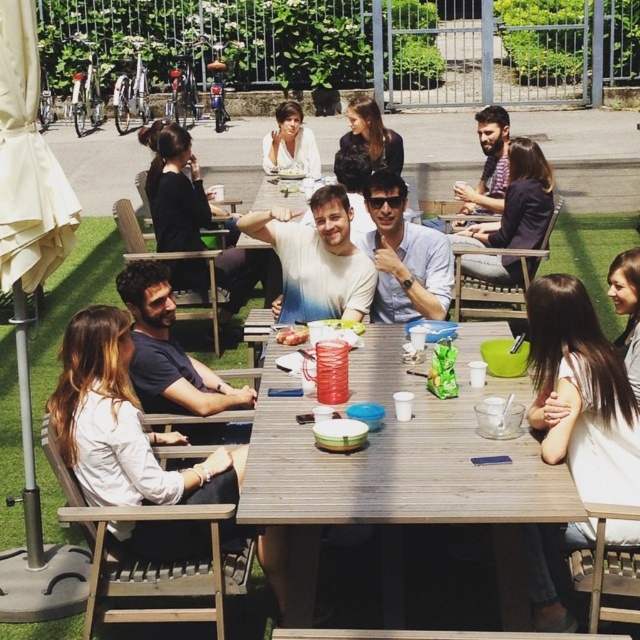
Question: Considering the real-world distances, which object is farthest from the dark blue t-shirt at left?

Choices:
 (A) translucent plastic bowl at center
 (B) white matte shirt at center
 (C) smooth plastic bowl at center

Answer: (B)

Question: Which of the following is the closest to the observer?

Choices:
 (A) matte black jacket at center
 (B) white shirt at lower left
 (C) white cotton t-shirt at center

Answer: (B)

Question: Is wooden table at center bigger than white matte shirt at center?

Choices:
 (A) yes
 (B) no

Answer: (A)

Question: Does white cotton t-shirt at center appear over translucent plastic bowl at center?

Choices:
 (A) yes
 (B) no

Answer: (A)

Question: Which point is closer to the camera?

Choices:
 (A) (260, 282)
 (B) (353, 260)

Answer: (B)

Question: Is white matte shirt at center bigger than smooth plastic bowl at center?

Choices:
 (A) yes
 (B) no

Answer: (A)